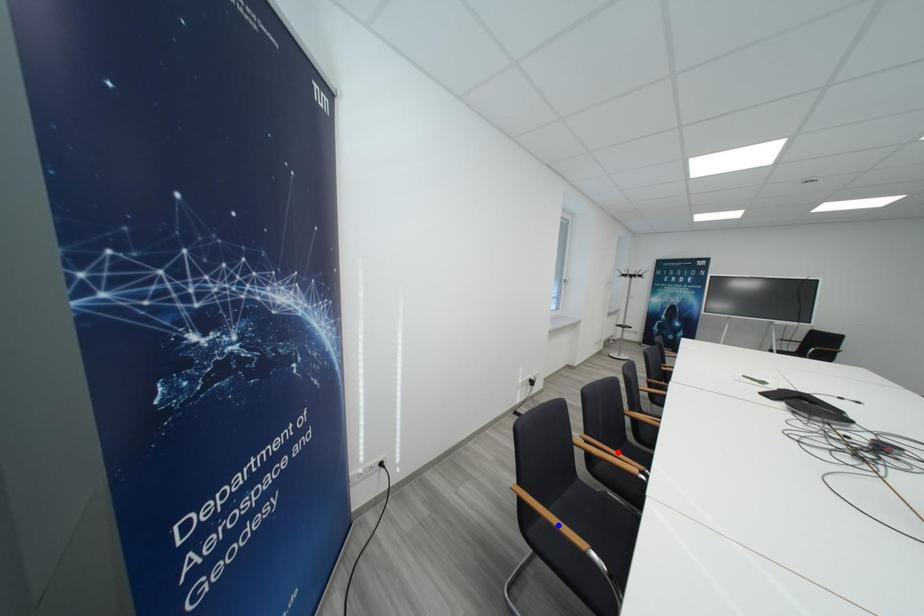
Question: Which of the two points in the image is closer to the camera?

Choices:
 (A) Blue point is closer.
 (B) Red point is closer.

Answer: (A)